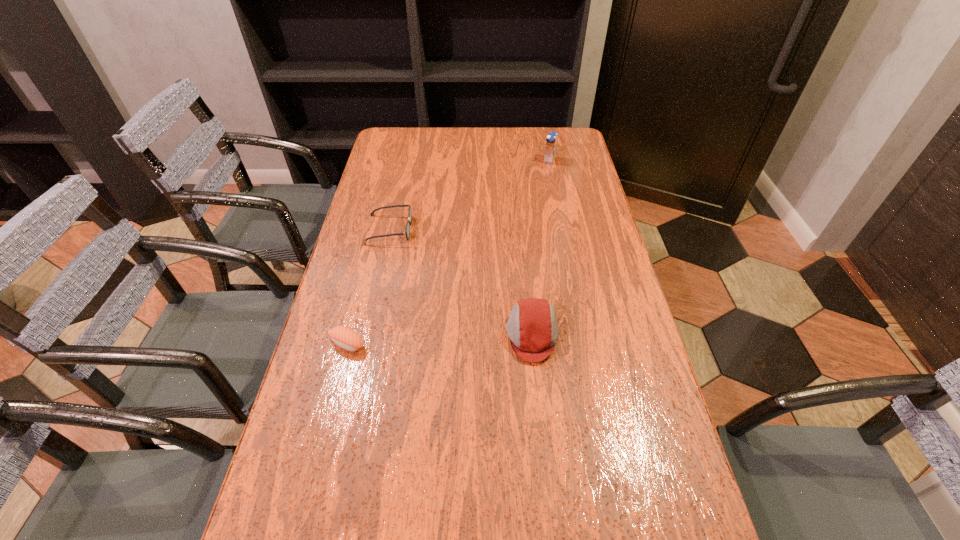
The image size is (960, 540). Identify the location of vacant space situated on the face of the third nearest object. (479, 230).

Find the location of a particular element. This screenshot has width=960, height=540. vacant point located on the right of the sushi is located at coordinates (399, 344).

The image size is (960, 540). Identify the location of object located in the far edge section of the desktop. (551, 141).

You are a GUI agent. You are given a task and a screenshot of the screen. Output one action in this format:
    pyautogui.click(x=<x>, y=<y>)
    Task: Click on the spectacles situated at the left edge
    The width and height of the screenshot is (960, 540).
    Given the screenshot: What is the action you would take?
    pyautogui.click(x=407, y=229)

Where is `sushi located in the left edge section of the desktop`? The image size is (960, 540). sushi located in the left edge section of the desktop is located at coordinates (345, 337).

Image resolution: width=960 pixels, height=540 pixels. I want to click on object that is at the right edge, so click(551, 141).

The image size is (960, 540). What are the coordinates of `object at the far right corner` in the screenshot? It's located at (551, 141).

Locate an element on the screen. The height and width of the screenshot is (540, 960). vacant space at the far edge of the desktop is located at coordinates (527, 144).

In the image, there is a desktop. Where is `vacant space at the left edge`? This screenshot has height=540, width=960. vacant space at the left edge is located at coordinates (337, 396).

In the image, there is a desktop. At what (x,y) coordinates should I click in order to perform the action: click on vacant space at the right edge. Please return your answer as a coordinate pair (x, y). Looking at the image, I should click on (624, 342).